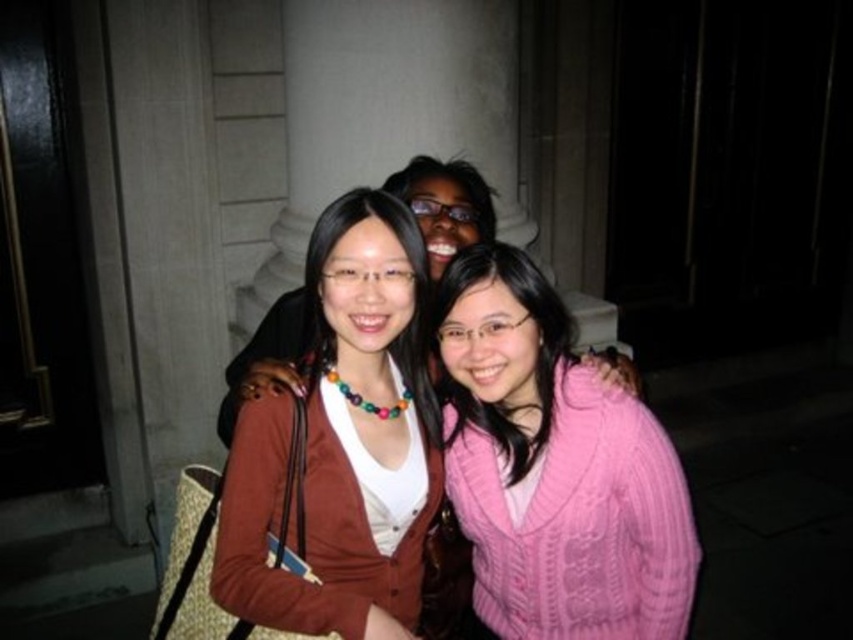
Question: Which object appears farthest from the camera in this image?

Choices:
 (A) pink knitted sweater at center
 (B) brown matte sweater at center
 (C) matte brown sweater at center

Answer: (C)

Question: Is pink knitted sweater at center positioned at the back of brown matte sweater at center?

Choices:
 (A) no
 (B) yes

Answer: (B)

Question: Can you confirm if pink knitted sweater at center is thinner than matte brown sweater at center?

Choices:
 (A) yes
 (B) no

Answer: (B)

Question: Is pink knitted sweater at center above brown matte sweater at center?

Choices:
 (A) yes
 (B) no

Answer: (B)

Question: Which object is farther from the camera taking this photo?

Choices:
 (A) pink knitted sweater at center
 (B) matte brown sweater at center
 (C) brown matte sweater at center

Answer: (B)

Question: Estimate the real-world distances between objects in this image. Which object is closer to the matte brown sweater at center?

Choices:
 (A) pink knitted sweater at center
 (B) brown matte sweater at center

Answer: (B)